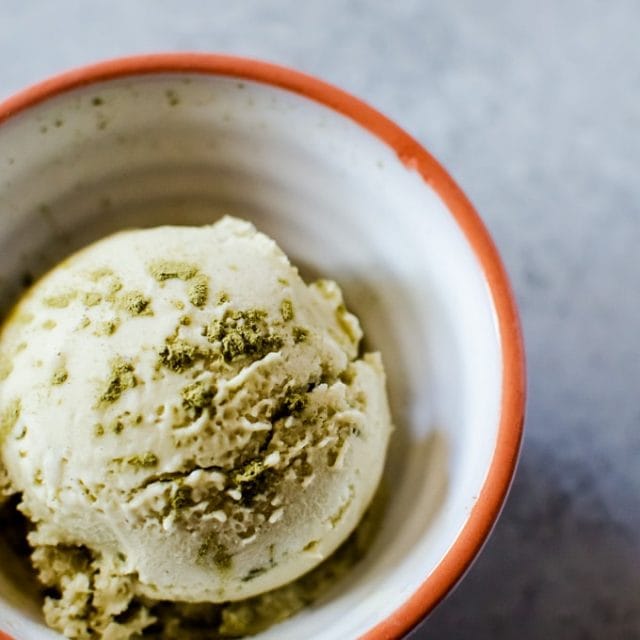
This screenshot has height=640, width=640. Find the location of `table top`. table top is located at coordinates (541, 185).